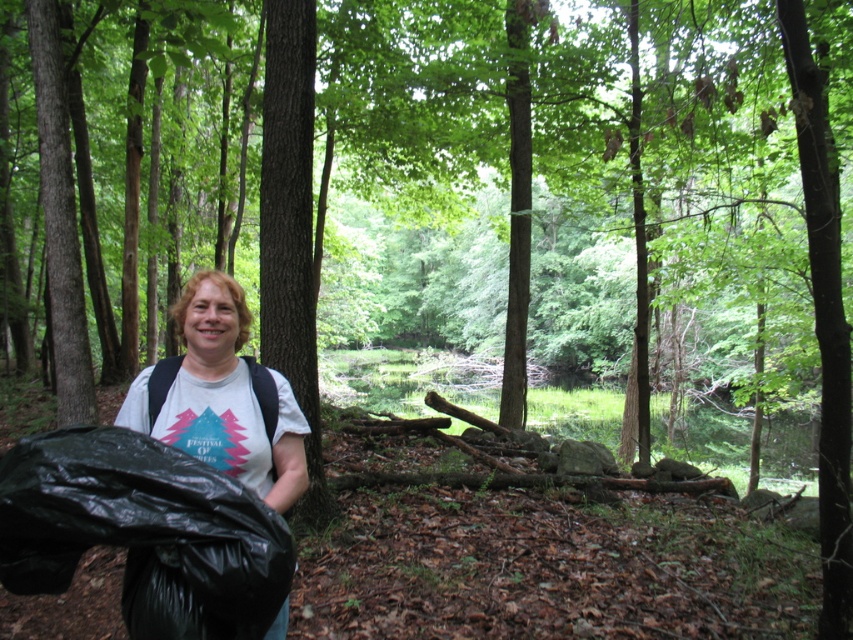
Between black plastic bag at lower left and white cotton t-shirt at center, which one has more height?

Standing taller between the two is white cotton t-shirt at center.

Does point (218, 502) come in front of point (224, 424)?

Yes, it is.

Which is behind, point (257, 588) or point (170, 438)?

Point (170, 438)

I want to click on black plastic bag at lower left, so click(143, 532).